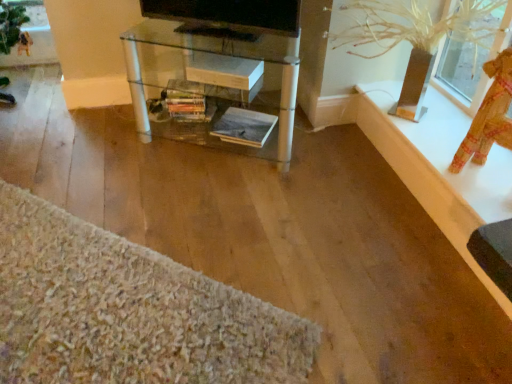
Question: Does clear glass table at center lie in front of textured fabric doll at upper right?

Choices:
 (A) no
 (B) yes

Answer: (A)

Question: From the image's perspective, is clear glass table at center located beneath textured fabric doll at upper right?

Choices:
 (A) no
 (B) yes

Answer: (A)

Question: Is clear glass table at center positioned beyond the bounds of textured fabric doll at upper right?

Choices:
 (A) yes
 (B) no

Answer: (A)

Question: Can you confirm if clear glass table at center is thinner than textured fabric doll at upper right?

Choices:
 (A) yes
 (B) no

Answer: (B)

Question: Is clear glass table at center further to the viewer compared to textured fabric doll at upper right?

Choices:
 (A) yes
 (B) no

Answer: (A)

Question: From their relative heights in the image, would you say textured fabric doll at upper right is taller or shorter than white glossy ledge at upper right?

Choices:
 (A) short
 (B) tall

Answer: (B)

Question: In the image, is textured fabric doll at upper right positioned in front of or behind white glossy ledge at upper right?

Choices:
 (A) behind
 (B) front

Answer: (B)

Question: Considering the relative positions of textured fabric doll at upper right and white glossy ledge at upper right in the image provided, is textured fabric doll at upper right to the left or to the right of white glossy ledge at upper right?

Choices:
 (A) left
 (B) right

Answer: (B)

Question: From a real-world perspective, relative to white glossy ledge at upper right, is textured fabric doll at upper right vertically above or below?

Choices:
 (A) above
 (B) below

Answer: (A)

Question: Is point (359, 16) positioned closer to the camera than point (254, 4)?

Choices:
 (A) closer
 (B) farther

Answer: (B)

Question: Considering their positions, is clear plastic vase at upper right located in front of or behind black glossy tv at upper center?

Choices:
 (A) behind
 (B) front

Answer: (B)

Question: In terms of size, does clear plastic vase at upper right appear bigger or smaller than black glossy tv at upper center?

Choices:
 (A) small
 (B) big

Answer: (B)

Question: Is clear plastic vase at upper right wider or thinner than black glossy tv at upper center?

Choices:
 (A) wide
 (B) thin

Answer: (A)

Question: Considering the positions of textured fabric doll at upper right and textured beige rug at lower left in the image, is textured fabric doll at upper right wider or thinner than textured beige rug at lower left?

Choices:
 (A) thin
 (B) wide

Answer: (A)

Question: From their relative heights in the image, would you say textured fabric doll at upper right is taller or shorter than textured beige rug at lower left?

Choices:
 (A) short
 (B) tall

Answer: (B)